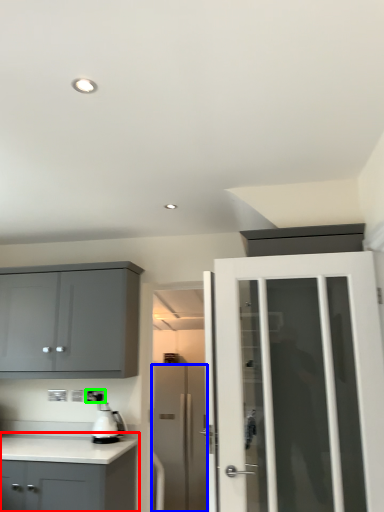
Question: Which is nearer to the cabinetry (highlighted by a red box)? door (highlighted by a blue box) or electric outlet (highlighted by a green box).

Choices:
 (A) door
 (B) electric outlet

Answer: (B)